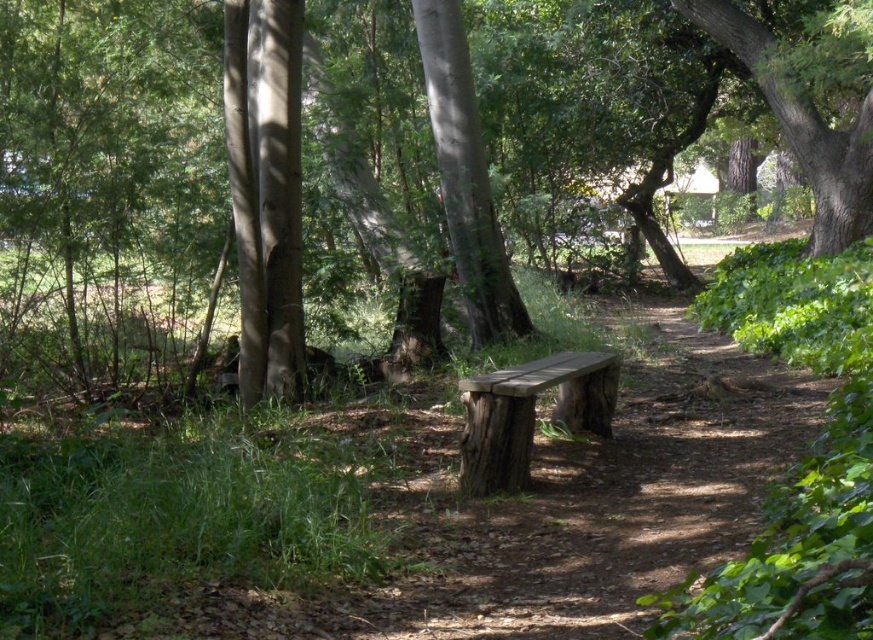
Question: Is smooth bark tree at center thinner than wooden bench at center?

Choices:
 (A) yes
 (B) no

Answer: (B)

Question: Among these points, which one is nearest to the camera?

Choices:
 (A) (253, 388)
 (B) (867, 90)
 (C) (476, 296)
 (D) (493, 381)

Answer: (D)

Question: Among these objects, which one is nearest to the camera?

Choices:
 (A) smooth bark tree at center
 (B) smooth brown tree trunk at center
 (C) green rough bark tree at upper right

Answer: (B)

Question: Considering the relative positions of smooth bark tree at center and wooden bench at center in the image provided, where is smooth bark tree at center located with respect to wooden bench at center?

Choices:
 (A) left
 (B) right

Answer: (A)

Question: In this image, where is smooth bark tree at center located relative to green rough bark tree at upper right?

Choices:
 (A) above
 (B) below

Answer: (B)

Question: Which of these objects is positioned closest to the green rough bark tree at upper right?

Choices:
 (A) smooth bark tree at center
 (B) smooth brown tree trunk at center

Answer: (A)